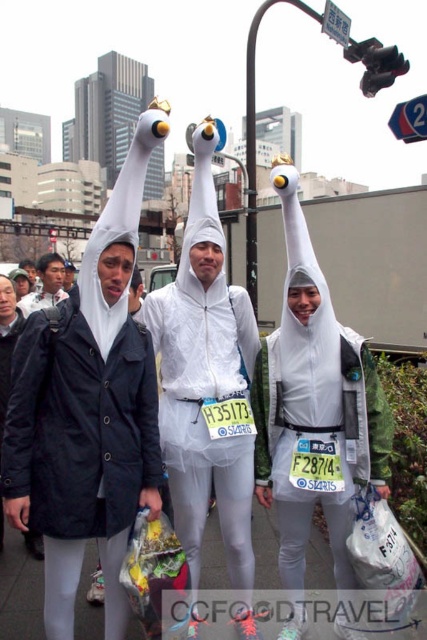
You are a photographer trying to capture a photo of the white matte swan at center and the matte black jacket at left. If you want to ensure both are fully visible in your shot, which one should you focus on first to avoid cropping?

The white matte swan at center is much taller than the matte black jacket at left, so you should focus on the white matte swan at center first to ensure its full height is captured without cropping.

You are a photographer trying to capture a group photo of the white matte swan at upper center and the matte black jacket at left. If you want to ensure both are fully visible in the frame, which object should you focus on to avoid cropping?

The white matte swan at upper center has a smaller width than the matte black jacket at left, so focusing on the matte black jacket at left will ensure both fit without cropping.